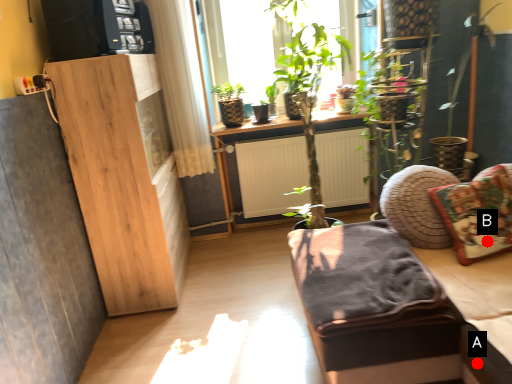
Question: Two points are circled on the image, labeled by A and B beside each circle. Which point appears closest to the camera in this image?

Choices:
 (A) A is closer
 (B) B is closer

Answer: (A)